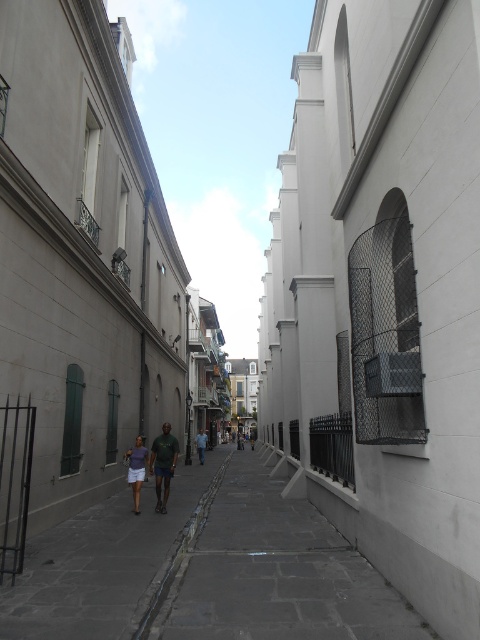
You are a photographer standing on the sidewalk of this narrow street scene. You want to take a photo of the matte purple shirt at center and the blue denim jeans at center. Since you can only focus on one subject at a time, which one should you focus on to ensure the other appears blurred in the background?

You should focus on the matte purple shirt at center because it is in front of the blue denim jeans at center, so focusing on the shirt will keep it sharp while the jeans will naturally blur in the background.

In the scene shown: You are a delivery person trying to navigate a narrow street with a wide cart. You see the dark gray concrete pavement at center and the blue denim jeans at center in the middle of the road. Which path should you choose to avoid the jeans and stay on the pavement?

The dark gray concrete pavement at center is wider than the blue denim jeans at center, so you should stay on the dark gray concrete pavement at center to avoid the jeans and ensure there is enough space for your cart.